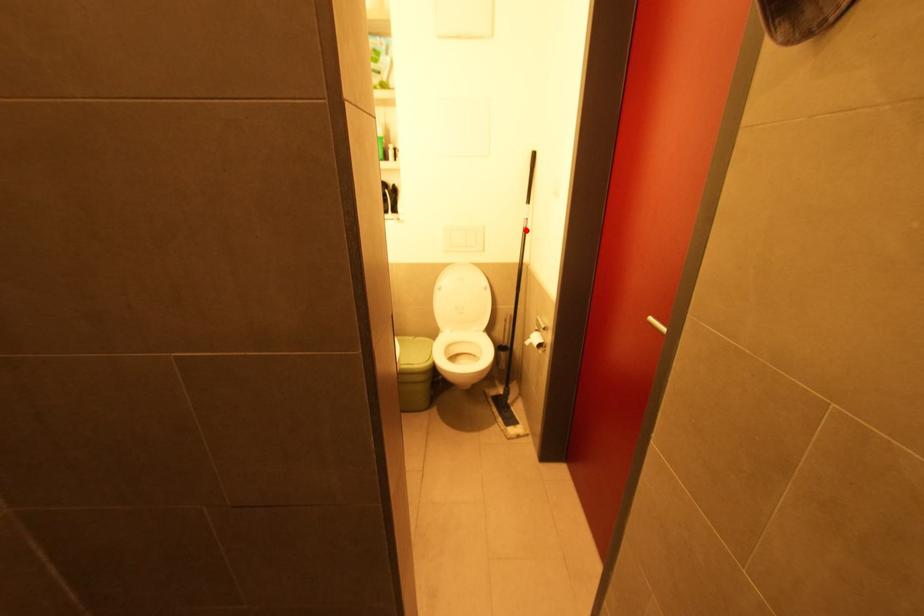
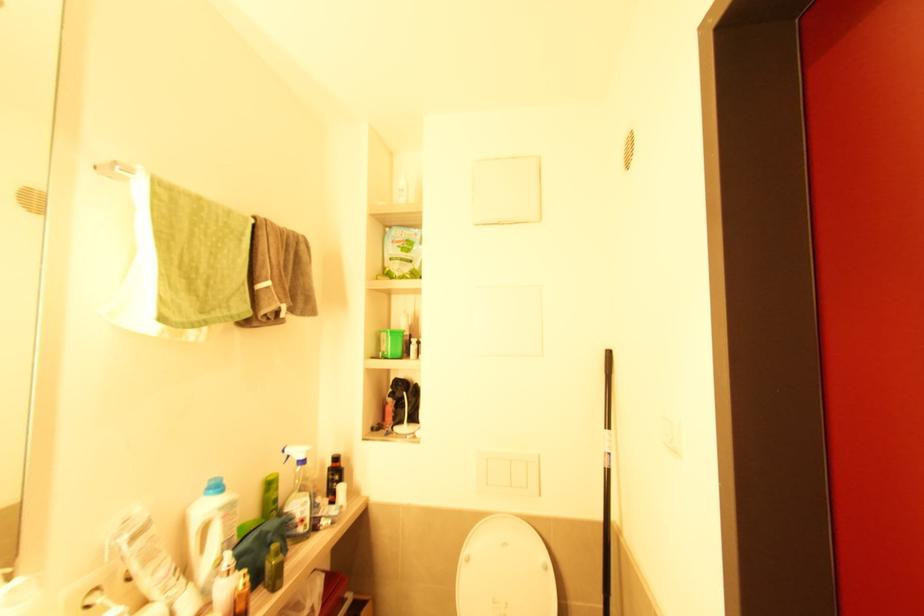
Where in the second image is the point corresponding to the highlighted location from the first image?

(610, 472)